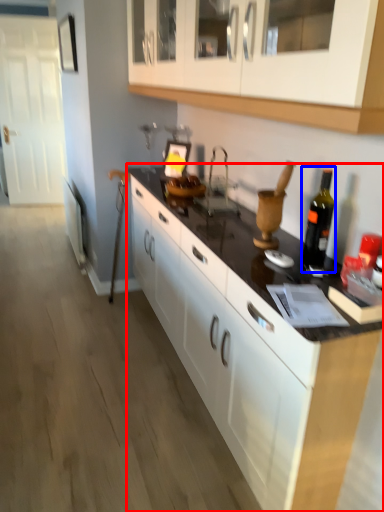
Question: Which object appears closest to the camera in this image, countertop (highlighted by a red box) or bottle (highlighted by a blue box)?

Choices:
 (A) countertop
 (B) bottle

Answer: (A)